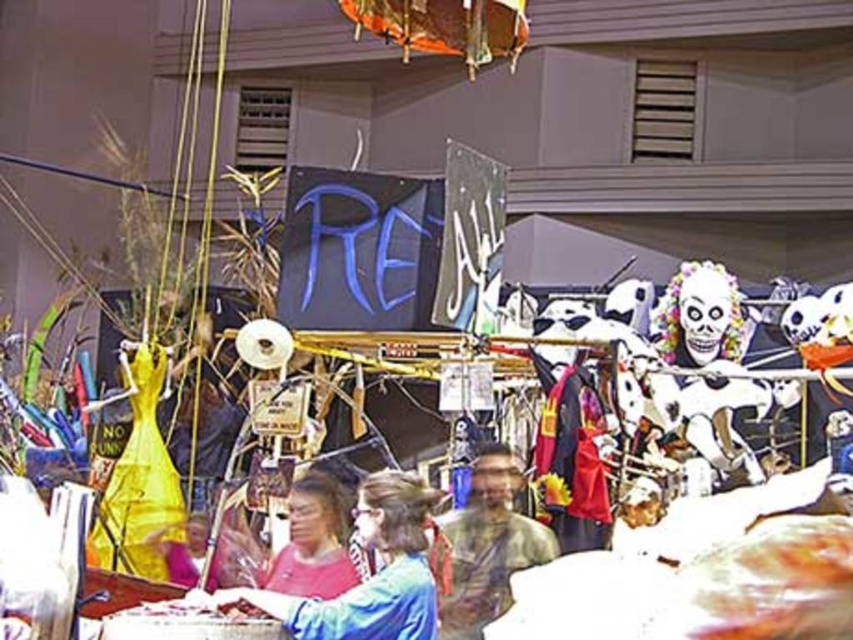
Question: Estimate the real-world distances between objects in this image. Which object is closer to the blue fabric shirt at center?

Choices:
 (A) matte pink shirt at center
 (B) camouflage-patterned shirt at center

Answer: (A)

Question: Is blue fabric shirt at center to the right of camouflage-patterned shirt at center from the viewer's perspective?

Choices:
 (A) no
 (B) yes

Answer: (A)

Question: Is blue fabric shirt at center further to camera compared to matte pink shirt at center?

Choices:
 (A) yes
 (B) no

Answer: (B)

Question: Does blue fabric shirt at center appear over matte pink shirt at center?

Choices:
 (A) yes
 (B) no

Answer: (B)

Question: Which point is closer to the camera?

Choices:
 (A) (306, 628)
 (B) (546, 557)
 (C) (345, 552)

Answer: (A)

Question: Which point is closer to the camera?

Choices:
 (A) (294, 630)
 (B) (335, 534)
 (C) (467, 525)

Answer: (A)